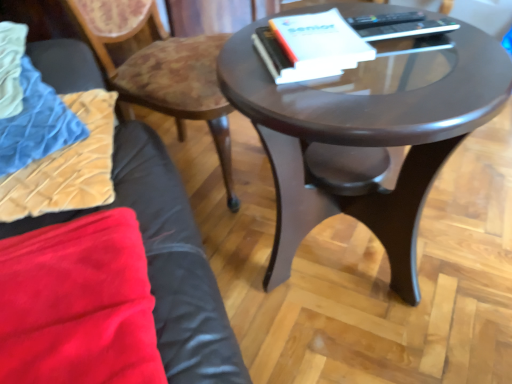
Where is `vacant space in front of white paper at center`? vacant space in front of white paper at center is located at coordinates (341, 105).